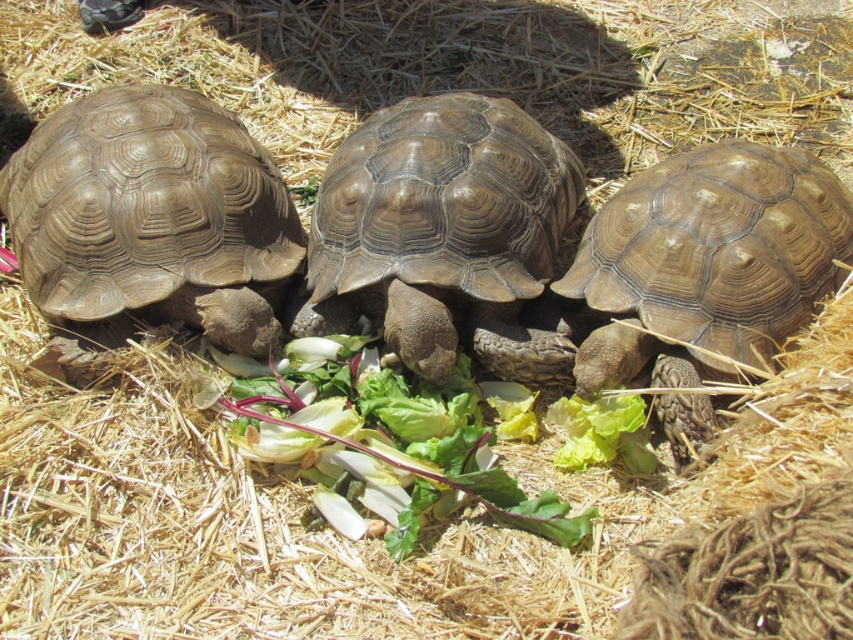
Is brown textured shell at left behind brown textured tortoise at center?

Yes.

Does brown textured shell at left have a smaller size compared to brown textured tortoise at center?

No, brown textured shell at left is not smaller than brown textured tortoise at center.

Identify the location of brown textured shell at left. The image size is (853, 640). (149, 224).

Can you confirm if brown textured tortoise at center is smaller than green leafy at center?

Incorrect, brown textured tortoise at center is not smaller in size than green leafy at center.

Who is taller, brown textured tortoise at center or green leafy at center?

brown textured tortoise at center is taller.

Who is more distant from viewer, [405,163] or [496,477]?

The point [405,163] is behind.

You are a GUI agent. You are given a task and a screenshot of the screen. Output one action in this format:
    pyautogui.click(x=<x>, y=<y>)
    Task: Click on the brown textured tortoise at center
    
    Given the screenshot: What is the action you would take?
    pyautogui.click(x=444, y=234)

Is matte brown tortoise at right bigger than green leafy at center?

Correct, matte brown tortoise at right is larger in size than green leafy at center.

What do you see at coordinates (708, 262) in the screenshot? I see `matte brown tortoise at right` at bounding box center [708, 262].

Which is behind, point (840, 208) or point (268, 445)?

The point (840, 208) is more distant.

This screenshot has width=853, height=640. I want to click on matte brown tortoise at right, so click(708, 262).